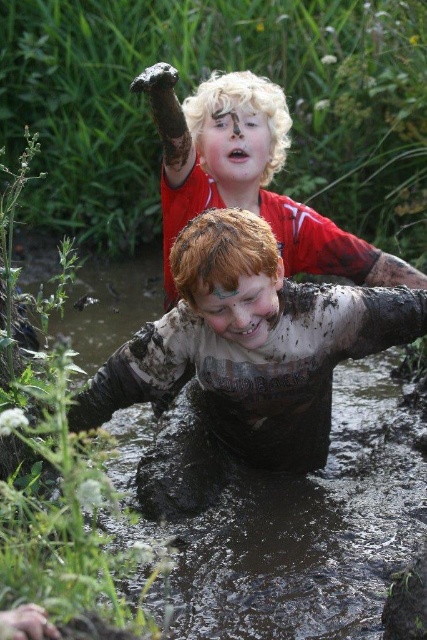
Question: Among these points, which one is farthest from the camera?

Choices:
 (A) (225, 589)
 (B) (254, 294)
 (C) (140, 83)

Answer: (C)

Question: Among these objects, which one is nearest to the camera?

Choices:
 (A) reddish-brown hair at center
 (B) muddy skin boy at center

Answer: (B)

Question: Which point is closer to the camera taking this photo?

Choices:
 (A) (207, 129)
 (B) (245, 352)

Answer: (B)

Question: Does muddy skin boy at center have a lesser width compared to blonde curly hair at upper center?

Choices:
 (A) yes
 (B) no

Answer: (B)

Question: Does blonde curly hair at upper center appear under blonde hair at upper center?

Choices:
 (A) yes
 (B) no

Answer: (A)

Question: Is muddy skin boy at center closer to camera compared to blonde curly hair at upper center?

Choices:
 (A) yes
 (B) no

Answer: (A)